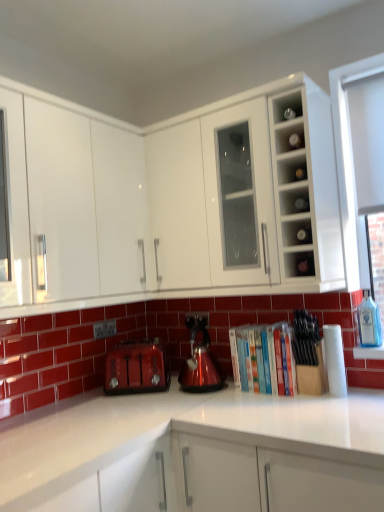
Question: Does clear glass bottles at upper right, the second shelf in the bottom-to-top sequence, appear on the left side of matte glass shelf at upper right, which is the 1th shelf from bottom to top?

Choices:
 (A) yes
 (B) no

Answer: (A)

Question: Does clear glass bottles at upper right, arranged as the third shelf when viewed from the top, have a greater width compared to matte glass shelf at upper right, which is the 1th shelf from bottom to top?

Choices:
 (A) yes
 (B) no

Answer: (A)

Question: Considering the relative positions of clear glass bottles at upper right, arranged as the third shelf when viewed from the top, and matte glass shelf at upper right, which is counted as the 4th shelf, starting from the top, in the image provided, is clear glass bottles at upper right, arranged as the third shelf when viewed from the top, behind matte glass shelf at upper right, which is counted as the 4th shelf, starting from the top,?

Choices:
 (A) yes
 (B) no

Answer: (A)

Question: From a real-world perspective, is clear glass bottles at upper right, arranged as the third shelf when viewed from the top, below matte glass shelf at upper right, which is counted as the 4th shelf, starting from the top?

Choices:
 (A) yes
 (B) no

Answer: (B)

Question: Is clear glass bottles at upper right, the second shelf in the bottom-to-top sequence, completely or partially outside of matte glass shelf at upper right, which is counted as the 4th shelf, starting from the top?

Choices:
 (A) yes
 (B) no

Answer: (A)

Question: Considering the relative positions of clear glass bottles at upper right, arranged as the third shelf when viewed from the top, and matte glass shelf at upper right, which is counted as the 4th shelf, starting from the top, in the image provided, is clear glass bottles at upper right, arranged as the third shelf when viewed from the top, to the right of matte glass shelf at upper right, which is counted as the 4th shelf, starting from the top, from the viewer's perspective?

Choices:
 (A) no
 (B) yes

Answer: (A)

Question: Is clear glass bottles at upper right, arranged as the third shelf when viewed from the top, closer to the viewer compared to hardcover books at center?

Choices:
 (A) yes
 (B) no

Answer: (A)

Question: From a real-world perspective, does clear glass bottles at upper right, the second shelf in the bottom-to-top sequence, stand above hardcover books at center?

Choices:
 (A) yes
 (B) no

Answer: (A)

Question: Considering the relative sizes of clear glass bottles at upper right, arranged as the third shelf when viewed from the top, and hardcover books at center in the image provided, is clear glass bottles at upper right, arranged as the third shelf when viewed from the top, shorter than hardcover books at center?

Choices:
 (A) yes
 (B) no

Answer: (A)

Question: Could hardcover books at center be considered to be inside clear glass bottles at upper right, arranged as the third shelf when viewed from the top?

Choices:
 (A) no
 (B) yes

Answer: (A)

Question: From the image's perspective, does clear glass bottles at upper right, arranged as the third shelf when viewed from the top, appear lower than hardcover books at center?

Choices:
 (A) yes
 (B) no

Answer: (B)

Question: Can you confirm if clear glass bottles at upper right, arranged as the third shelf when viewed from the top, is positioned to the right of hardcover books at center?

Choices:
 (A) yes
 (B) no

Answer: (A)

Question: From the image's perspective, is shiny metallic kettle at center above white glossy cabinet at upper center, the second cabinetry viewed from the left?

Choices:
 (A) yes
 (B) no

Answer: (B)